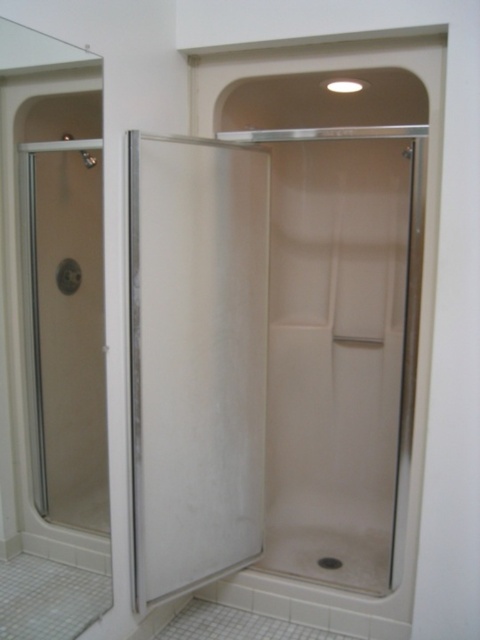
Is transparent glass shower door at center closer to the viewer compared to clear glass shower door at left?

No, it is not.

Is point (206, 308) less distant than point (39, 392)?

No, (206, 308) is behind (39, 392).

What are the coordinates of `transparent glass shower door at center` in the screenshot? It's located at point(195,358).